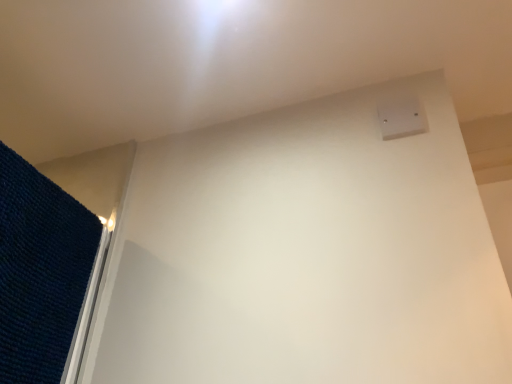
Question: Is white plastic electric outlet at upper right turned away from dark blue textured mat at left?

Choices:
 (A) no
 (B) yes

Answer: (A)

Question: Is white plastic electric outlet at upper right to the left of dark blue textured mat at left from the viewer's perspective?

Choices:
 (A) no
 (B) yes

Answer: (A)

Question: Does white plastic electric outlet at upper right have a lesser height compared to dark blue textured mat at left?

Choices:
 (A) yes
 (B) no

Answer: (A)

Question: Can you confirm if white plastic electric outlet at upper right is bigger than dark blue textured mat at left?

Choices:
 (A) no
 (B) yes

Answer: (A)

Question: Does white plastic electric outlet at upper right come in front of dark blue textured mat at left?

Choices:
 (A) yes
 (B) no

Answer: (B)

Question: From the image's perspective, is white plastic electric outlet at upper right beneath dark blue textured mat at left?

Choices:
 (A) yes
 (B) no

Answer: (B)

Question: Can you confirm if dark blue textured mat at left is thinner than white plastic electric outlet at upper right?

Choices:
 (A) no
 (B) yes

Answer: (A)

Question: Is dark blue textured mat at left shorter than white plastic electric outlet at upper right?

Choices:
 (A) yes
 (B) no

Answer: (B)

Question: Considering the relative sizes of dark blue textured mat at left and white plastic electric outlet at upper right in the image provided, is dark blue textured mat at left smaller than white plastic electric outlet at upper right?

Choices:
 (A) no
 (B) yes

Answer: (A)

Question: From a real-world perspective, is dark blue textured mat at left under white plastic electric outlet at upper right?

Choices:
 (A) yes
 (B) no

Answer: (A)

Question: Can you confirm if dark blue textured mat at left is taller than white plastic electric outlet at upper right?

Choices:
 (A) no
 (B) yes

Answer: (B)

Question: Is dark blue textured mat at left not inside white plastic electric outlet at upper right?

Choices:
 (A) no
 (B) yes

Answer: (B)

Question: Considering the positions of dark blue textured mat at left and white plastic electric outlet at upper right in the image, is dark blue textured mat at left wider or thinner than white plastic electric outlet at upper right?

Choices:
 (A) wide
 (B) thin

Answer: (A)